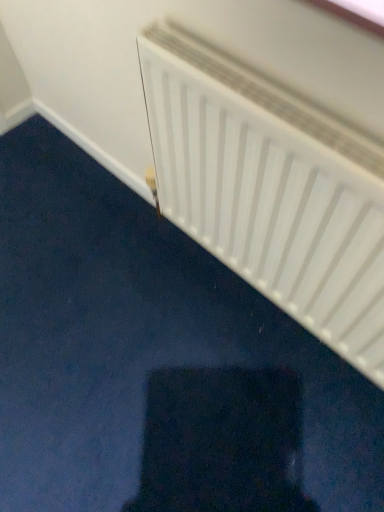
Describe the element at coordinates (271, 188) in the screenshot. The image size is (384, 512). I see `white matte radiator at upper right` at that location.

Where is `white matte radiator at upper right`? This screenshot has width=384, height=512. white matte radiator at upper right is located at coordinates (271, 188).

Image resolution: width=384 pixels, height=512 pixels. In order to click on white matte radiator at upper right in this screenshot , I will do `click(271, 188)`.